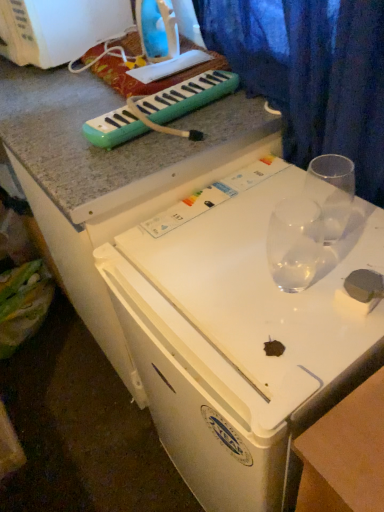
Locate an element on the screen. free space above green plastic melodica at upper center (from a real-world perspective) is located at coordinates (170, 91).